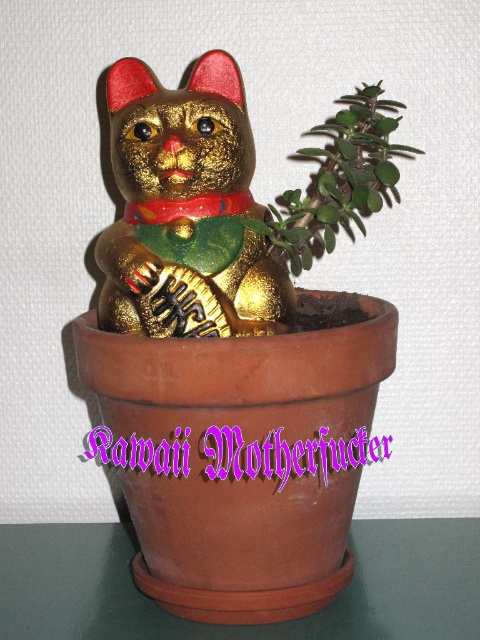
Question: Is gold shiny cat at center closer to camera compared to green matte plant at upper right?

Choices:
 (A) yes
 (B) no

Answer: (A)

Question: Which point appears farthest from the camera in this image?

Choices:
 (A) (226, 172)
 (B) (327, 209)

Answer: (B)

Question: Can you confirm if gold shiny cat at center is positioned below green matte plant at upper right?

Choices:
 (A) no
 (B) yes

Answer: (B)

Question: Can you confirm if gold shiny cat at center is positioned below green matte plant at upper right?

Choices:
 (A) no
 (B) yes

Answer: (B)